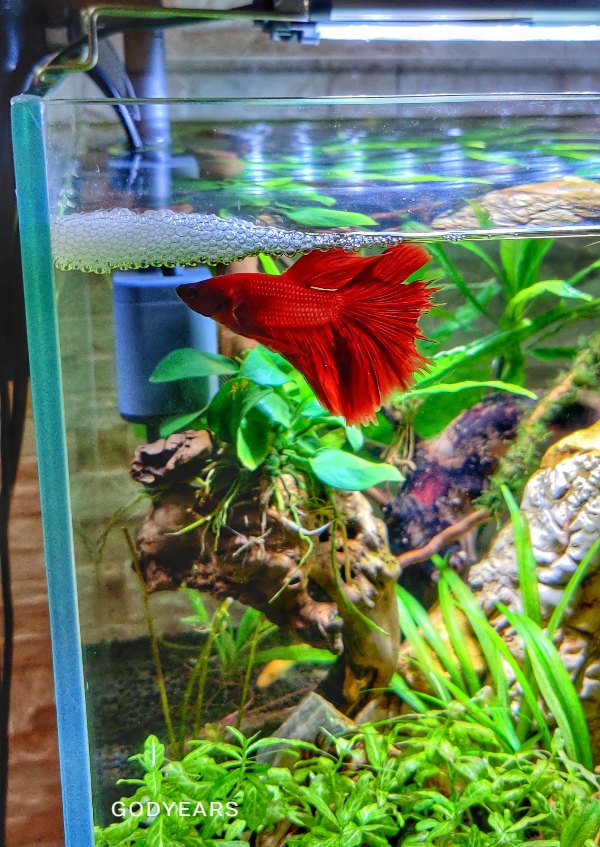
Identify the location of brown table. (22, 759).